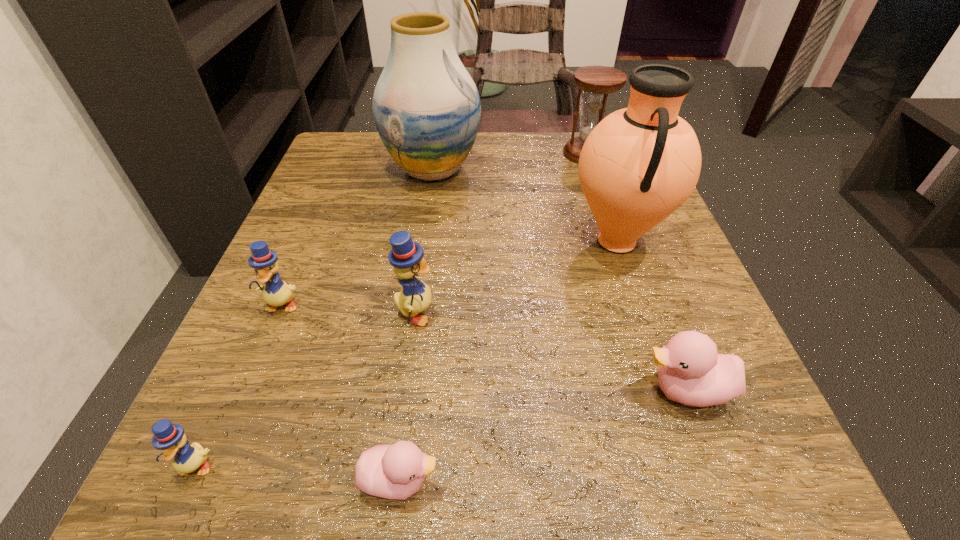
Locate an element on the screen. Image resolution: width=960 pixels, height=540 pixels. vase at the far edge is located at coordinates click(x=426, y=107).

Identify the location of hourglass that is at the far edge. (598, 81).

Locate an element on the screen. Image resolution: width=960 pixels, height=540 pixels. vase that is at the left edge is located at coordinates (426, 107).

This screenshot has height=540, width=960. Identify the location of pitcher that is at the right edge. (639, 164).

The image size is (960, 540). I want to click on hourglass present at the right edge, so click(x=598, y=81).

Image resolution: width=960 pixels, height=540 pixels. Identify the location of duckling present at the right edge. (691, 371).

Identify the location of object that is at the far left corner. The height and width of the screenshot is (540, 960). (426, 107).

Locate an element on the screen. object at the near left corner is located at coordinates (170, 438).

Identify the location of object that is at the far right corner. (598, 81).

Find the location of a particular element. vacant space at the far edge is located at coordinates (398, 165).